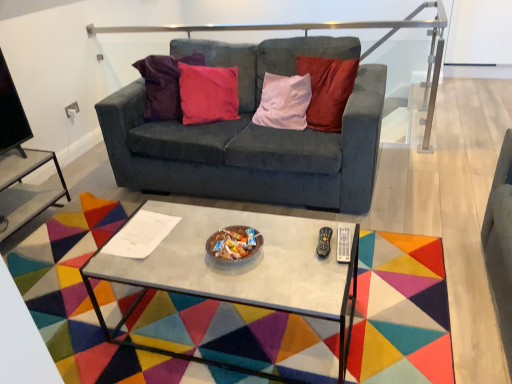
Question: Could you tell me if metallic gray coffee table at center is facing metallic silver side table at lower left?

Choices:
 (A) yes
 (B) no

Answer: (B)

Question: Does metallic gray coffee table at center appear on the right side of metallic silver side table at lower left?

Choices:
 (A) no
 (B) yes

Answer: (B)

Question: From the image's perspective, is metallic gray coffee table at center beneath metallic silver side table at lower left?

Choices:
 (A) yes
 (B) no

Answer: (A)

Question: Is metallic gray coffee table at center positioned with its back to metallic silver side table at lower left?

Choices:
 (A) yes
 (B) no

Answer: (A)

Question: Can you confirm if metallic gray coffee table at center is smaller than metallic silver side table at lower left?

Choices:
 (A) no
 (B) yes

Answer: (A)

Question: Does metallic gray coffee table at center come in front of metallic silver side table at lower left?

Choices:
 (A) no
 (B) yes

Answer: (B)

Question: Is velvet dark gray couch at center facing away from metallic silver side table at lower left?

Choices:
 (A) no
 (B) yes

Answer: (A)

Question: Is velvet dark gray couch at center oriented towards metallic silver side table at lower left?

Choices:
 (A) no
 (B) yes

Answer: (A)

Question: Does velvet dark gray couch at center lie in front of metallic silver side table at lower left?

Choices:
 (A) yes
 (B) no

Answer: (A)

Question: From a real-world perspective, is velvet dark gray couch at center under metallic silver side table at lower left?

Choices:
 (A) no
 (B) yes

Answer: (A)

Question: Can we say velvet dark gray couch at center lies outside metallic silver side table at lower left?

Choices:
 (A) no
 (B) yes

Answer: (B)

Question: Does velvet dark gray couch at center appear on the left side of metallic silver side table at lower left?

Choices:
 (A) yes
 (B) no

Answer: (B)

Question: Considering the relative sizes of satin silver rail at upper center and metallic gray coffee table at center in the image provided, is satin silver rail at upper center wider than metallic gray coffee table at center?

Choices:
 (A) yes
 (B) no

Answer: (B)